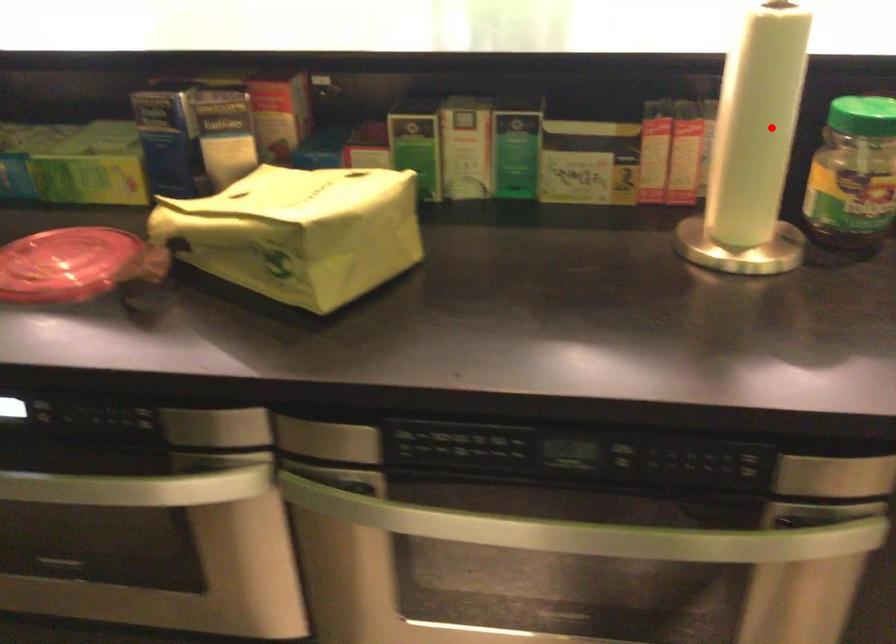
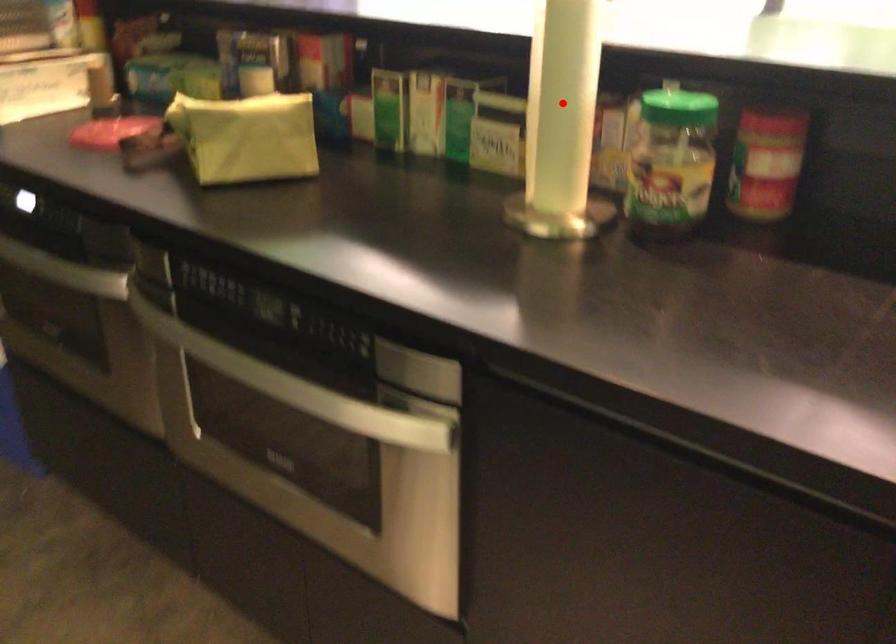
I am providing you with two images of the same scene from different viewpoints. A red point is marked on the first image and another point is marked on the second image. Is the red point in image1 aligned with the point shown in image2?

Yes